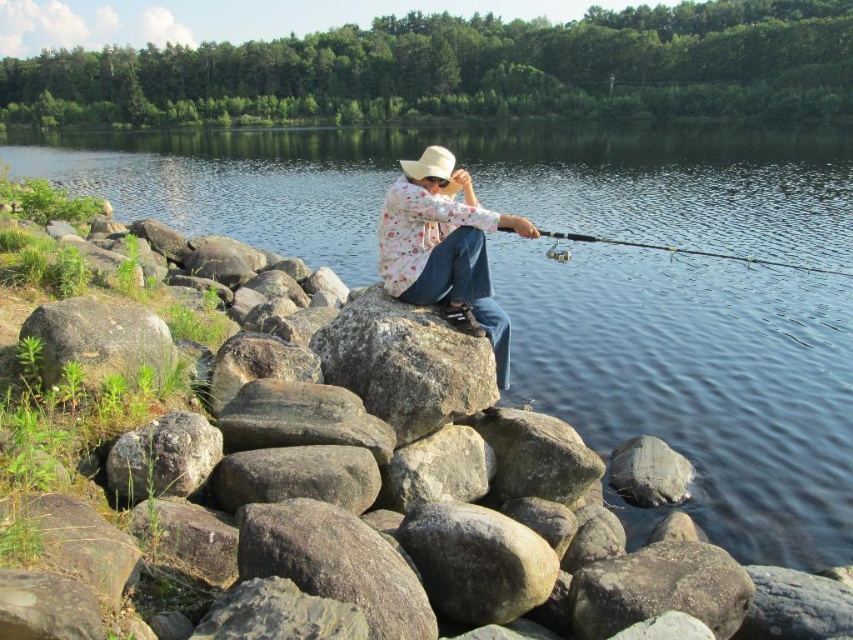
Question: Which point is farther to the camera?

Choices:
 (A) clear water at center
 (B) white woven cowboy hat at center

Answer: (B)

Question: Can you confirm if smooth gray rock at lower center is wider than clear plastic rod at center?

Choices:
 (A) yes
 (B) no

Answer: (B)

Question: Does floral fabric shirt at center appear on the right side of clear plastic rod at center?

Choices:
 (A) yes
 (B) no

Answer: (B)

Question: Based on their relative distances, which object is nearer to the clear plastic rod at center?

Choices:
 (A) smooth gray rock at lower center
 (B) white woven cowboy hat at center
 (C) clear water at center

Answer: (A)

Question: Estimate the real-world distances between objects in this image. Which object is closer to the white woven cowboy hat at center?

Choices:
 (A) gray rough rock at center
 (B) smooth gray rock at lower center
 (C) floral fabric shirt at center
 (D) clear plastic rod at center

Answer: (A)

Question: Is gray rough rock at center wider than white woven cowboy hat at center?

Choices:
 (A) no
 (B) yes

Answer: (B)